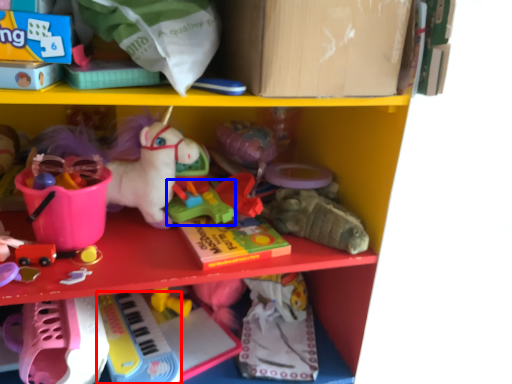
Question: Which point is further to the camera, toy (highlighted by a red box) or toy (highlighted by a blue box)?

Choices:
 (A) toy
 (B) toy

Answer: (B)